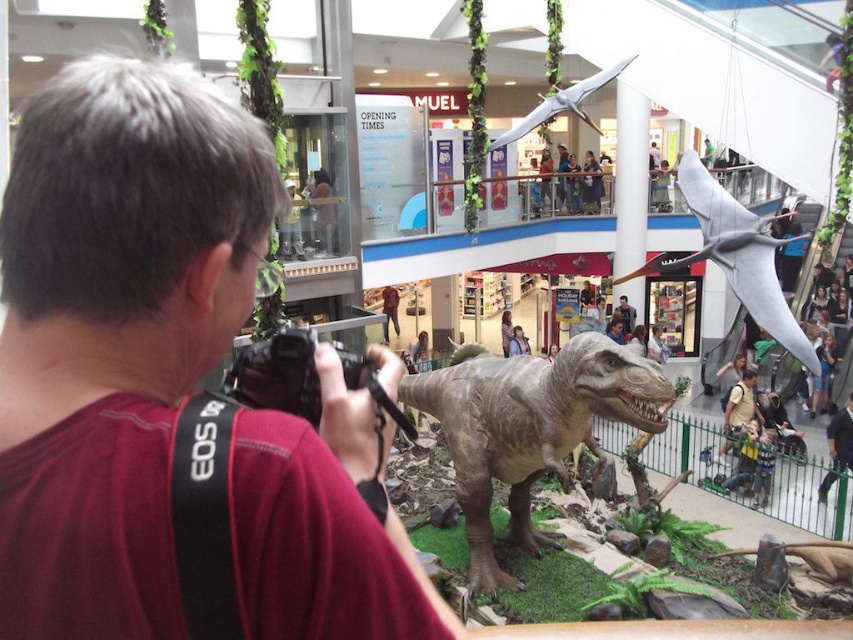
Question: Which point is closer to the camera?

Choices:
 (A) (274, 554)
 (B) (546, 182)

Answer: (A)

Question: Does maroon fabric shirt at center have a larger size compared to light brown leather jacket at upper center?

Choices:
 (A) no
 (B) yes

Answer: (A)

Question: Estimate the real-world distances between objects in this image. Which object is farther from the maroon fabric shirt at center?

Choices:
 (A) smooth brown leather jacket at center
 (B) gray textured dinosaur at center
 (C) gray matte pterodactyl at upper center

Answer: (A)

Question: In this image, where is maroon fabric shirt at center located relative to gray matte dinosaur at upper right?

Choices:
 (A) left
 (B) right

Answer: (A)

Question: Which object is farther from the camera taking this photo?

Choices:
 (A) smooth brown leather jacket at center
 (B) maroon fabric shirt at center

Answer: (A)

Question: Can you confirm if gray textured dinosaur at center is bigger than smooth brown leather jacket at center?

Choices:
 (A) yes
 (B) no

Answer: (A)